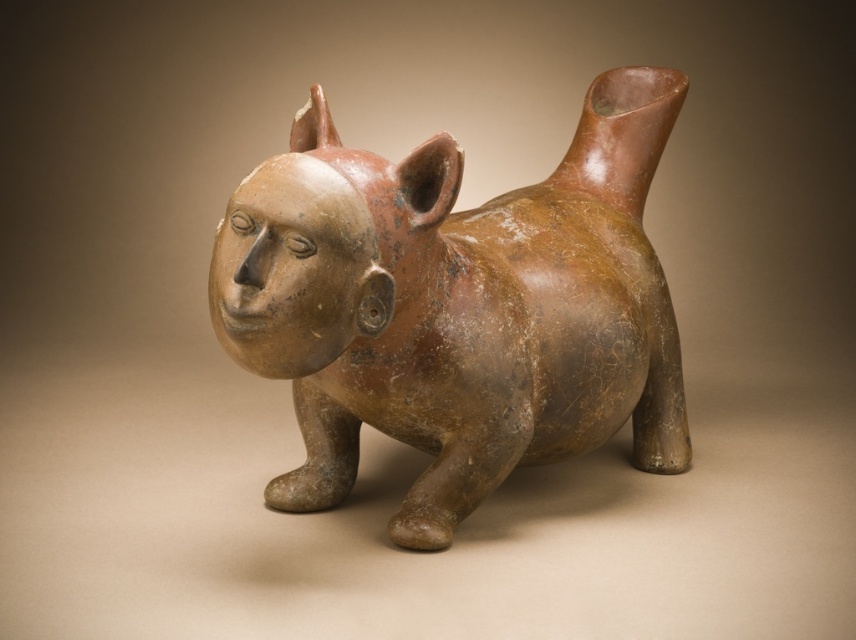
Based on the description provided, what can you infer about the size relationship between the brown matte animal at center and the matte clay head at center?

The brown matte animal at center is much taller than the matte clay head at center.

Looking at the ancient ceramic sculpture, which object is positioned lower between the brown matte animal at center and the matte clay head at center?

The brown matte animal at center is located below the matte clay head at center, so the brown matte animal at center is positioned lower.

What are the coordinates of the brown matte animal at center in the image?

The brown matte animal at center is located at coordinates point (456, 307).